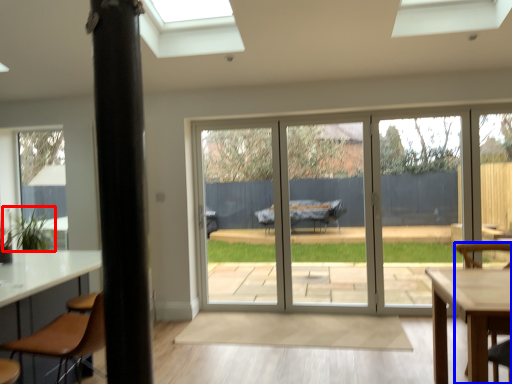
Question: Which object appears closest to the camera in this image, plant (highlighted by a red box) or chair (highlighted by a blue box)?

Choices:
 (A) plant
 (B) chair

Answer: (B)